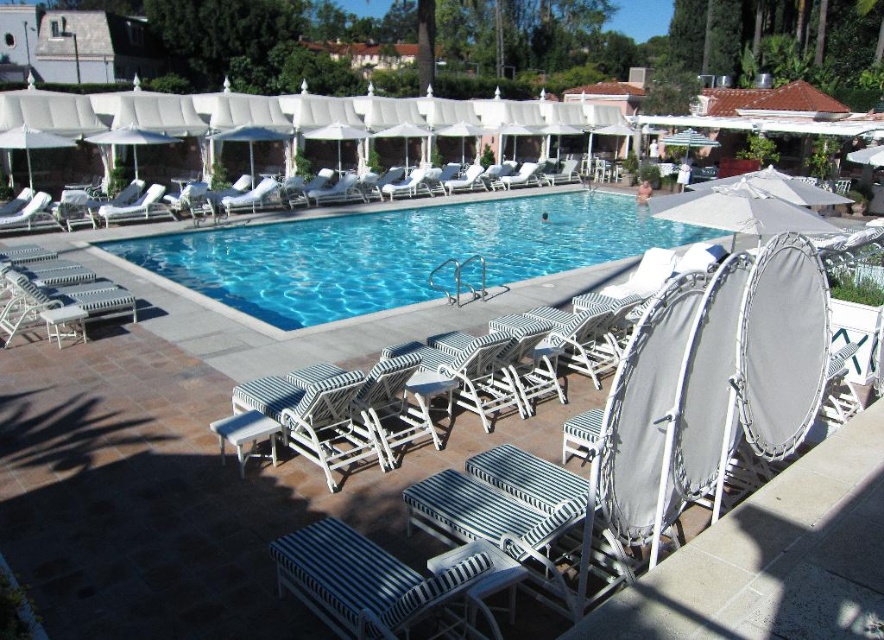
Who is shorter, white fabric umbrella at upper center or white fabric umbrella at upper right?

Standing shorter between the two is white fabric umbrella at upper center.

Who is higher up, white fabric umbrella at upper center or white fabric umbrella at upper right?

white fabric umbrella at upper right

Is point (789, 227) less distant than point (799, 195)?

Yes, point (789, 227) is closer to viewer.

Image resolution: width=884 pixels, height=640 pixels. Identify the location of white fabric umbrella at upper center. (738, 211).

Does striped fabric lounge chair at center have a greater width compared to white fabric umbrella at upper center?

Indeed, striped fabric lounge chair at center has a greater width compared to white fabric umbrella at upper center.

Does point (394, 605) come in front of point (770, 195)?

Yes, point (394, 605) is closer to viewer.

Find the location of a particular element. The image size is (884, 640). striped fabric lounge chair at center is located at coordinates pyautogui.click(x=378, y=586).

Identify the location of striped fabric lounge chair at center. (378, 586).

Identify the location of blue glossy pool at center. (395, 252).

Who is lower down, blue glossy pool at center or white fabric umbrella at upper left?

blue glossy pool at center is below.

Locate an element on the screen. The image size is (884, 640). blue glossy pool at center is located at coordinates (395, 252).